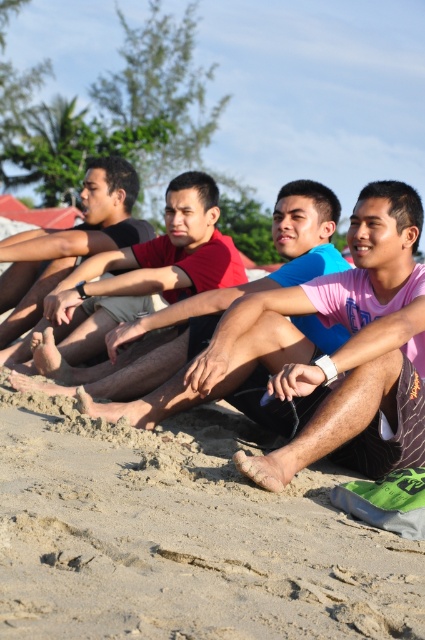
Question: Which object appears closest to the camera in this image?

Choices:
 (A) sandy beach at lower center
 (B) red shirt at center

Answer: (A)

Question: Does sandy beach at lower center have a larger size compared to red shirt at center?

Choices:
 (A) no
 (B) yes

Answer: (B)

Question: Which point is closer to the camera taking this photo?

Choices:
 (A) (70, 508)
 (B) (93, 340)

Answer: (A)

Question: In this image, where is sandy beach at lower center located relative to red shirt at center?

Choices:
 (A) left
 (B) right

Answer: (B)

Question: Is sandy beach at lower center to the left of red shirt at center from the viewer's perspective?

Choices:
 (A) yes
 (B) no

Answer: (B)

Question: Which point is farther from the camera taking this photo?

Choices:
 (A) (144, 257)
 (B) (42, 525)

Answer: (A)